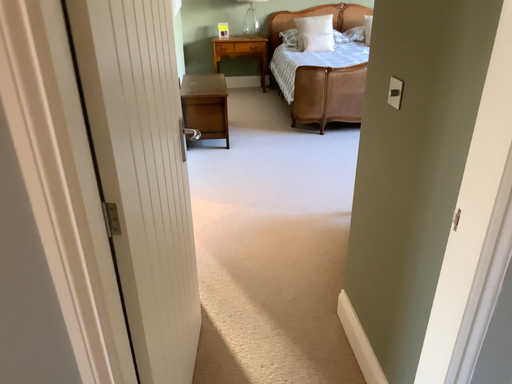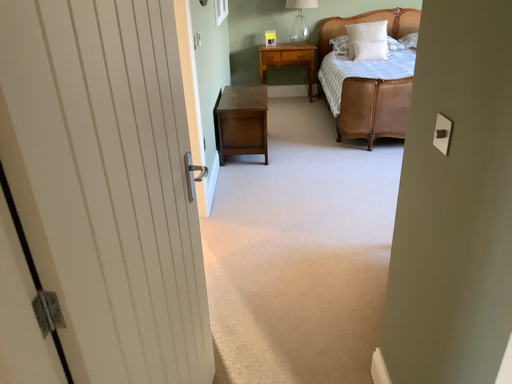
Question: Which way did the camera rotate in the video?

Choices:
 (A) rotated right
 (B) rotated left

Answer: (B)